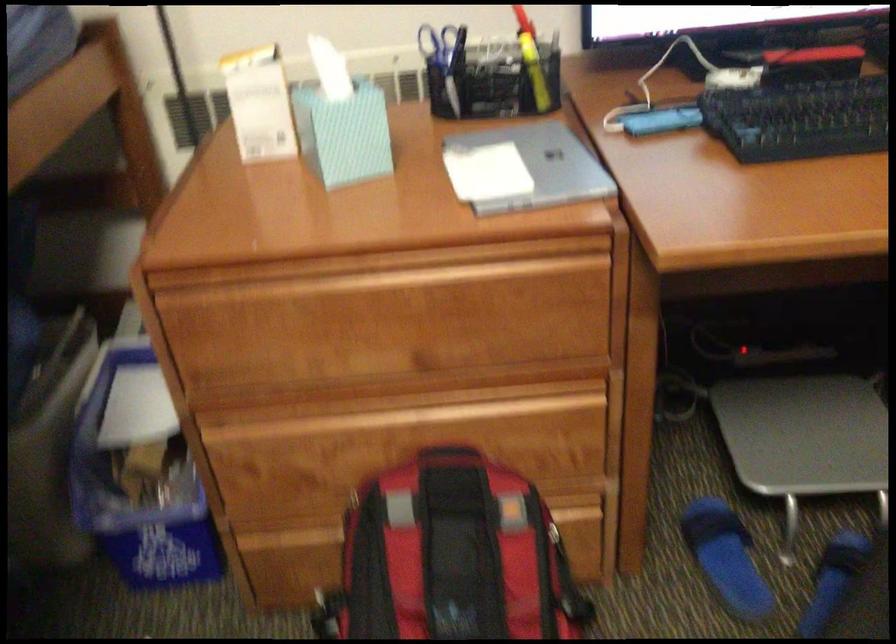
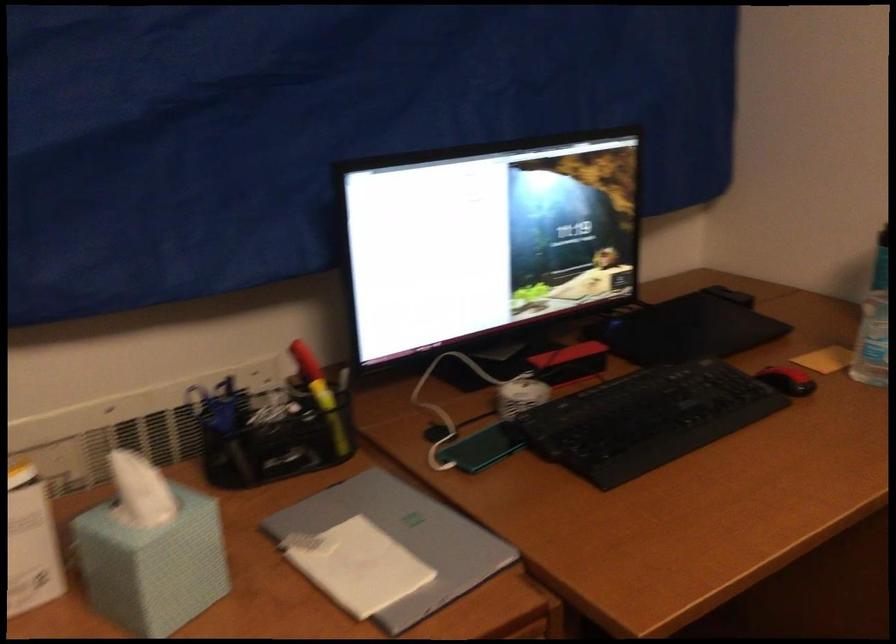
Where in the second image is the point corresponding to (x=804, y=67) from the first image?

(570, 363)